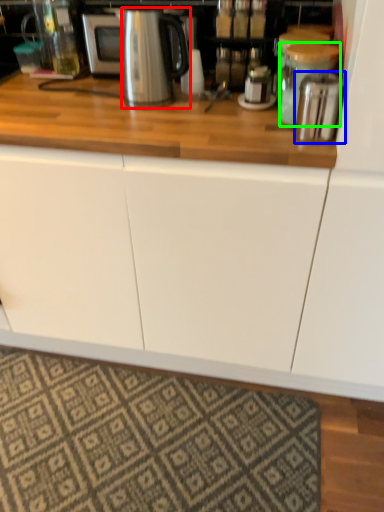
Question: Based on their relative distances, which object is farther from kitchen appliance (highlighted by a red box)? Choose from appliance (highlighted by a blue box) and appliance (highlighted by a green box).

Choices:
 (A) appliance
 (B) appliance

Answer: (A)